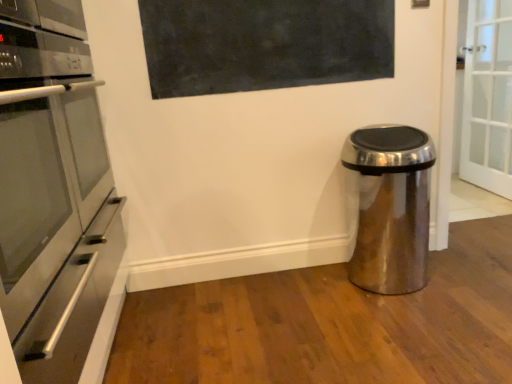
Question: From their relative heights in the image, would you say matte black board at upper center is taller or shorter than stainless steel oven at left?

Choices:
 (A) tall
 (B) short

Answer: (B)

Question: Would you say matte black board at upper center is to the left or to the right of stainless steel oven at left in the picture?

Choices:
 (A) right
 (B) left

Answer: (A)

Question: Which is farther from the stainless steel oven at left?

Choices:
 (A) matte black board at upper center
 (B) satin metallic trash can at lower right

Answer: (B)

Question: Which of these objects is positioned farthest from the stainless steel oven at left?

Choices:
 (A) satin metallic trash can at lower right
 (B) matte black board at upper center

Answer: (A)